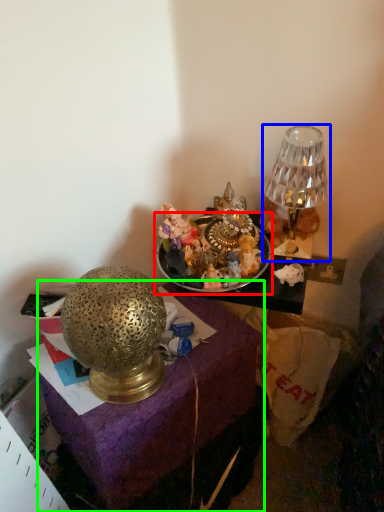
Question: Which is nearer to the tableware (highlighted by a red box)? lamp (highlighted by a blue box) or furniture (highlighted by a green box).

Choices:
 (A) lamp
 (B) furniture

Answer: (A)